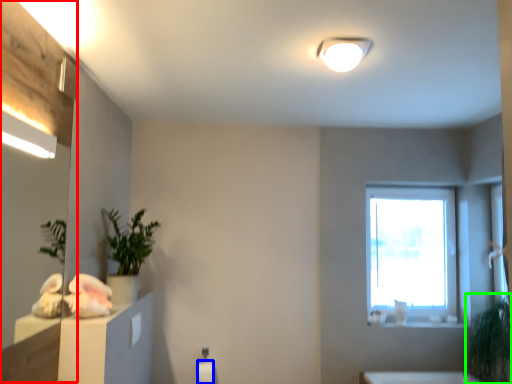
Question: Based on their relative distances, which object is farther from mirror (highlighted by a red box)? Choose from toilet paper (highlighted by a blue box) and plant (highlighted by a green box).

Choices:
 (A) toilet paper
 (B) plant

Answer: (B)